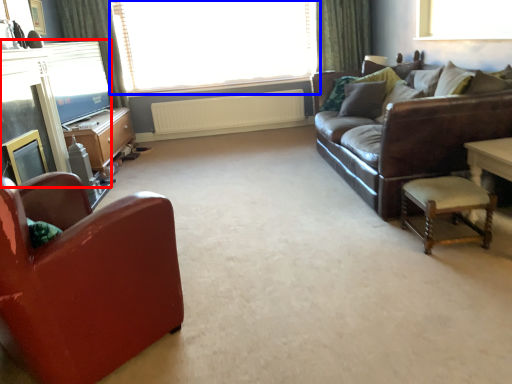
Question: Which of the following is the closest to the observer, fireplace (highlighted by a red box) or window (highlighted by a blue box)?

Choices:
 (A) fireplace
 (B) window

Answer: (A)